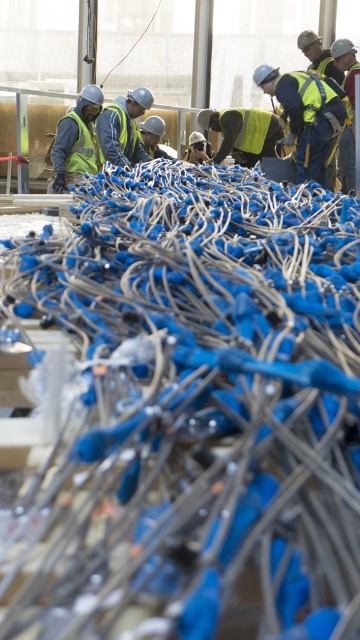
Question: Estimate the real-world distances between objects in this image. Which object is closer to the reflective yellow safety vest at center?

Choices:
 (A) yellow reflective vest at center
 (B) yellow reflective safety vest at center

Answer: (A)

Question: Which point is farther from the camera taking this photo?

Choices:
 (A) (267, 131)
 (B) (82, 129)
 (C) (321, 90)
 (D) (118, 150)

Answer: (A)

Question: Is matte black safety vest at left above yellow reflective safety vest at center?

Choices:
 (A) no
 (B) yes

Answer: (A)

Question: Is reflective yellow vest at upper right wider than yellow reflective safety vest at center?

Choices:
 (A) no
 (B) yes

Answer: (B)

Question: Can you confirm if reflective yellow vest at upper right is positioned to the right of reflective yellow safety vest at center?

Choices:
 (A) no
 (B) yes

Answer: (B)

Question: Based on their relative distances, which object is nearer to the reflective yellow safety vest at center?

Choices:
 (A) yellow reflective vest at center
 (B) yellow reflective safety vest at center

Answer: (A)